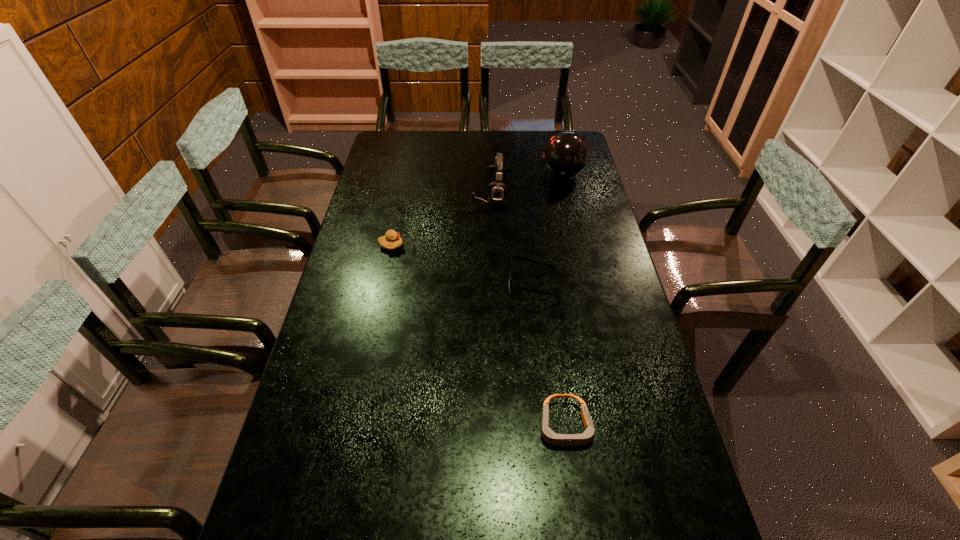
The width and height of the screenshot is (960, 540). Identify the location of free space between the second shortest object and the nearest object. (549, 355).

This screenshot has width=960, height=540. I want to click on empty location between the headset and the shortest object, so click(527, 310).

This screenshot has height=540, width=960. I want to click on vacant space in between the headset and the shortest object, so (x=527, y=310).

Identify which object is the second closest to the fourth tallest object. Please provide its 2D coordinates. Your answer should be formatted as a tuple, i.e. [(x, y)], where the tuple contains the x and y coordinates of a point satisfying the conditions above.

[(549, 436)]

Point out which object is positioned as the fourth nearest to the leftmost object. Please provide its 2D coordinates. Your answer should be formatted as a tuple, i.e. [(x, y)], where the tuple contains the x and y coordinates of a point satisfying the conditions above.

[(549, 436)]